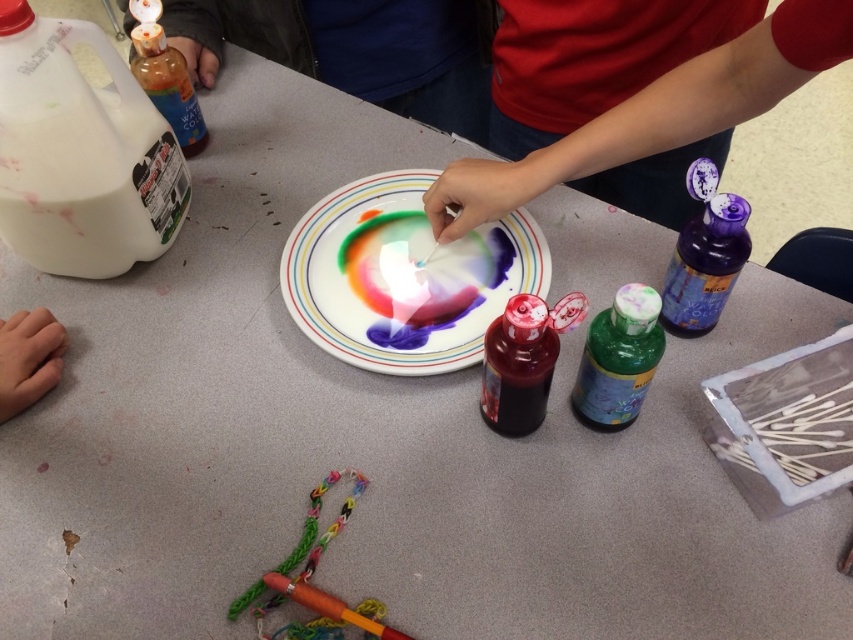
Which is above, white matte milk at top left or smooth red shirt at upper right?

Positioned higher is white matte milk at top left.

Can you confirm if white matte milk at top left is smaller than smooth red shirt at upper right?

Indeed, white matte milk at top left has a smaller size compared to smooth red shirt at upper right.

What do you see at coordinates (80, 154) in the screenshot? I see `white matte milk at top left` at bounding box center [80, 154].

Find the location of a particular element. white matte milk at top left is located at coordinates (80, 154).

Does skinny flesh at lower left appear over translucent plastic bottle at upper left?

No, skinny flesh at lower left is not above translucent plastic bottle at upper left.

Is skinny flesh at lower left further to the viewer compared to translucent plastic bottle at upper left?

No, it is not.

Who is more forward, (15, 401) or (172, 58)?

Point (15, 401) is in front.

In order to click on skinny flesh at lower left in this screenshot , I will do `click(28, 358)`.

Can you confirm if rainbow-colored paper plate at center is bigger than skinny flesh at lower left?

Indeed, rainbow-colored paper plate at center has a larger size compared to skinny flesh at lower left.

Is rainbow-colored paper plate at center in front of skinny flesh at lower left?

That is False.

Where is `rainbow-colored paper plate at center`? The width and height of the screenshot is (853, 640). rainbow-colored paper plate at center is located at coordinates (403, 276).